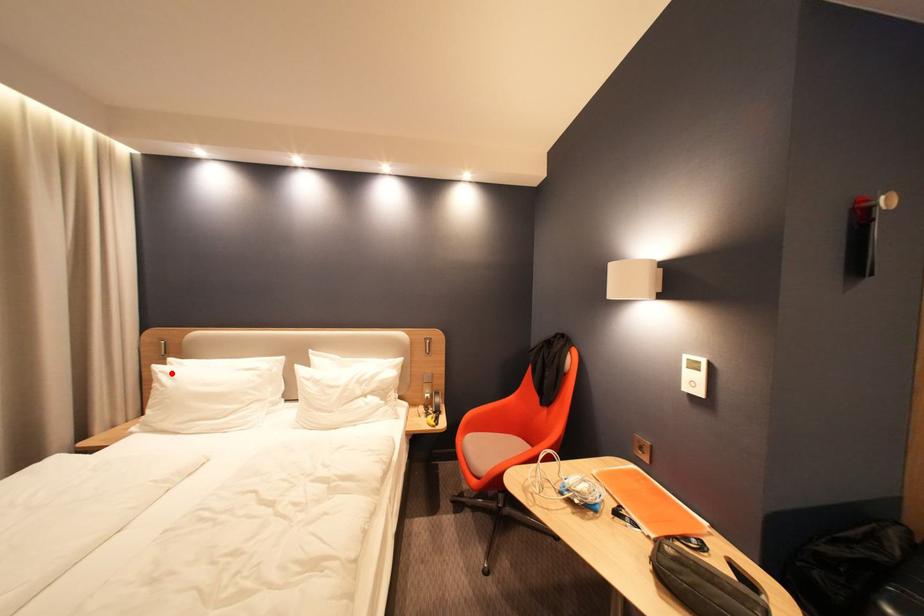
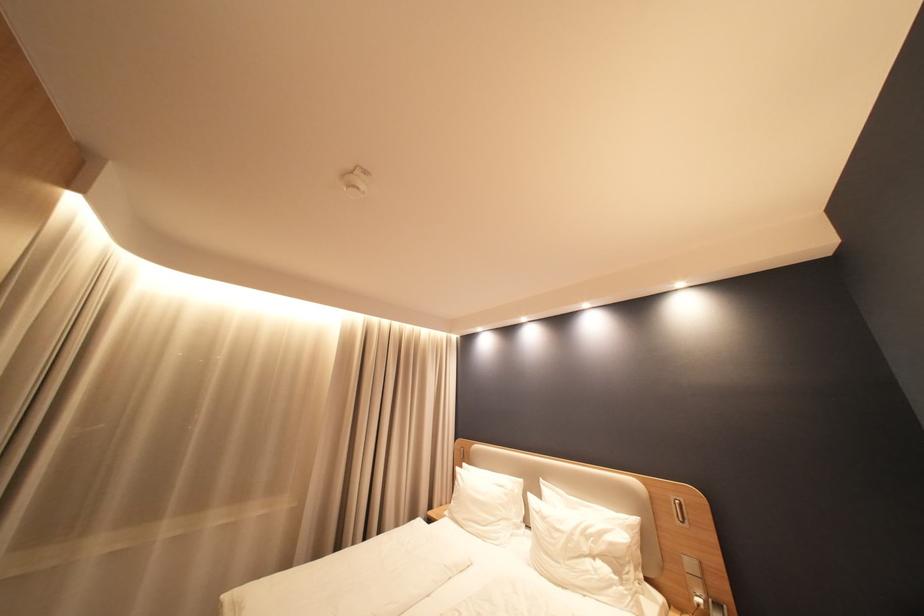
Where in the second image is the point corresponding to the highlighted location from the first image?

(468, 475)